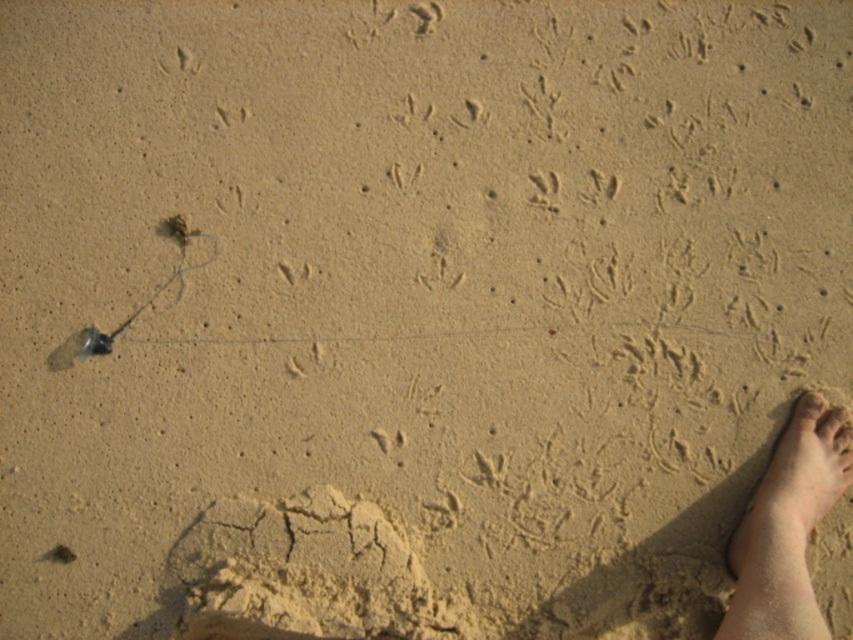
Question: Does light skin textured foot at lower right have a larger size compared to smooth skin toe at lower right?

Choices:
 (A) yes
 (B) no

Answer: (A)

Question: Does light skin textured foot at lower right have a larger size compared to smooth skin toe at lower right?

Choices:
 (A) yes
 (B) no

Answer: (A)

Question: Can you confirm if light skin textured foot at lower right is bigger than smooth skin toe at lower right?

Choices:
 (A) yes
 (B) no

Answer: (A)

Question: Which point appears closest to the camera in this image?

Choices:
 (A) click(x=827, y=496)
 (B) click(x=819, y=420)

Answer: (A)